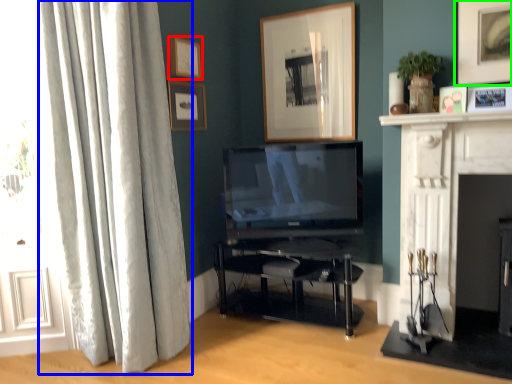
Question: Which object is positioned farthest from picture frame (highlighted by a red box)? Select from curtain (highlighted by a blue box) and picture frame (highlighted by a green box).

Choices:
 (A) curtain
 (B) picture frame

Answer: (B)